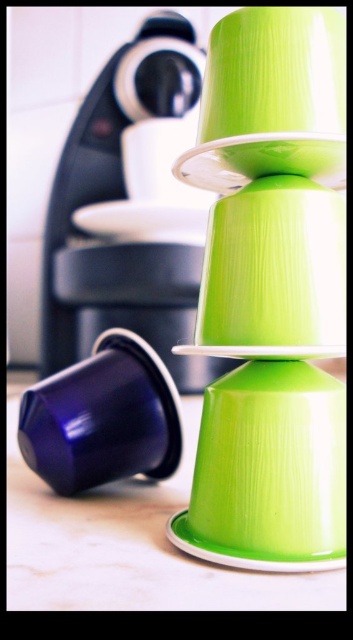
Does white glossy plate at center have a lesser width compared to white glossy saucer at center?

In fact, white glossy plate at center might be wider than white glossy saucer at center.

You are a GUI agent. You are given a task and a screenshot of the screen. Output one action in this format:
    pyautogui.click(x=<x>, y=<y>)
    Task: Click on the white glossy plate at center
    
    Given the screenshot: What is the action you would take?
    pyautogui.click(x=142, y=221)

Is point (177, 273) closer to viewer compared to point (102, 508)?

No.

Is black plastic coffee machine at upper center to the right of green plastic cup at lower center from the viewer's perspective?

Incorrect, black plastic coffee machine at upper center is not on the right side of green plastic cup at lower center.

Which is behind, point (120, 273) or point (42, 493)?

The point (120, 273) is behind.

I want to click on black plastic coffee machine at upper center, so (x=129, y=209).

Can you confirm if green plastic cups at center is positioned above green plastic cup at lower center?

Indeed, green plastic cups at center is positioned over green plastic cup at lower center.

What do you see at coordinates (271, 292) in the screenshot?
I see `green plastic cups at center` at bounding box center [271, 292].

Locate an element on the screen. This screenshot has height=640, width=353. green plastic cups at center is located at coordinates (271, 292).